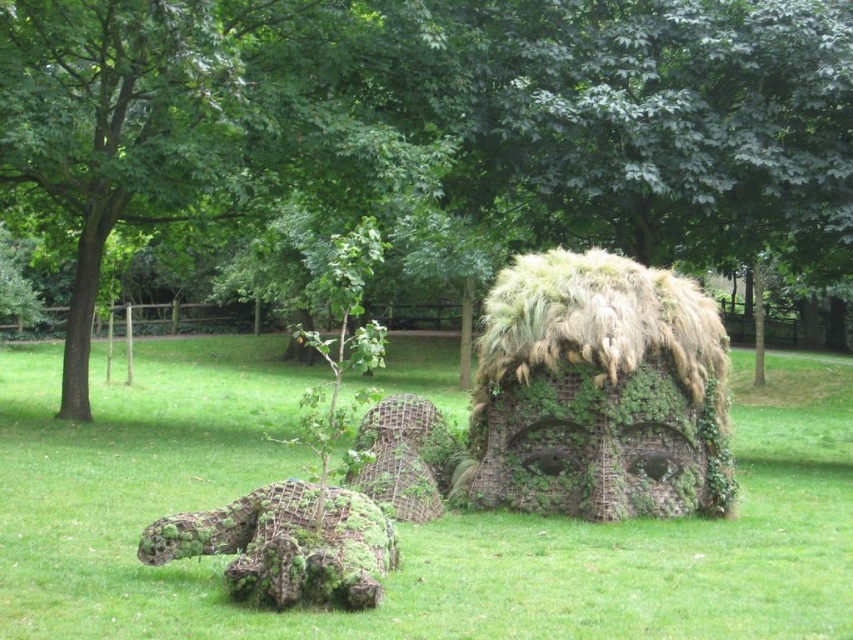
Question: Can you confirm if green mossy tree at center is positioned above green mossy sculpture at center?

Choices:
 (A) no
 (B) yes

Answer: (B)

Question: Can you confirm if green mossy tree at center is wider than green mossy sculpture at center?

Choices:
 (A) yes
 (B) no

Answer: (B)

Question: Can you confirm if green mossy tree at center is thinner than green mossy sculpture at center?

Choices:
 (A) yes
 (B) no

Answer: (A)

Question: Among these objects, which one is nearest to the camera?

Choices:
 (A) green mossy sculpture at center
 (B) green mossy tree at center

Answer: (A)

Question: Which point is farther to the camera?

Choices:
 (A) (498, 195)
 (B) (141, 352)

Answer: (B)